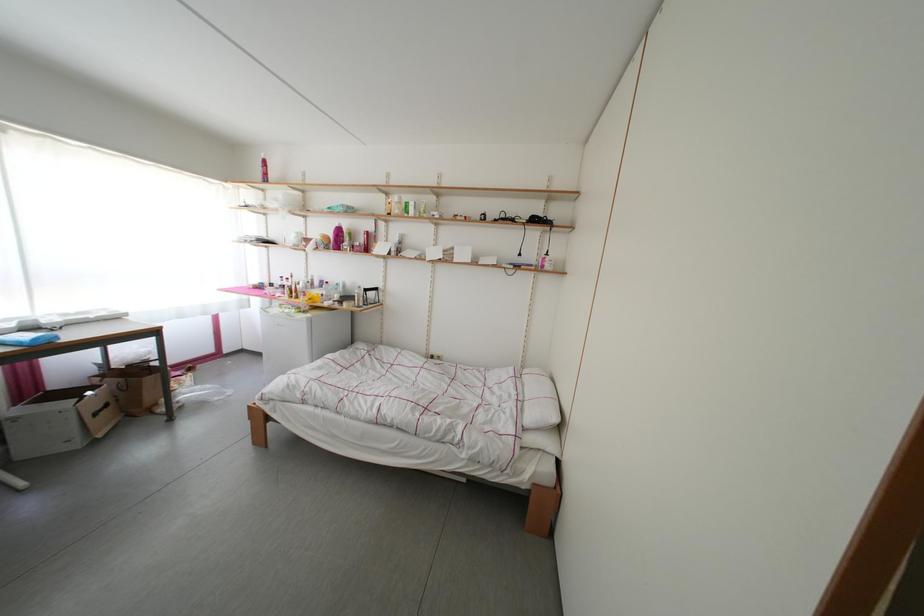
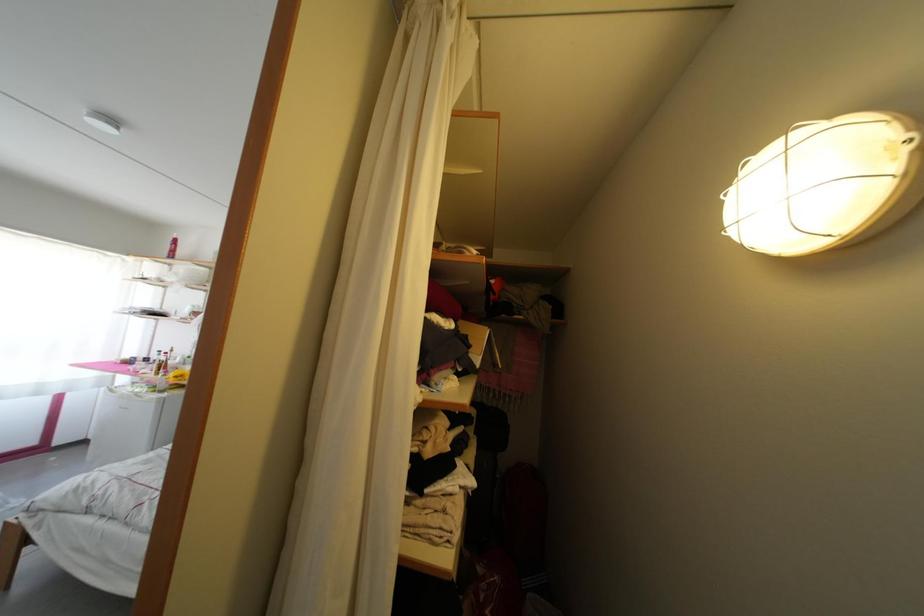
Question: In a continuous first-person perspective shot, in which direction is the camera moving?

Choices:
 (A) Left
 (B) Right
 (C) Forward
 (D) Backward

Answer: (B)